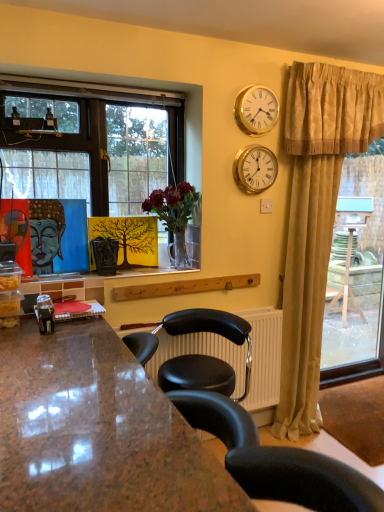
This screenshot has width=384, height=512. Describe the element at coordinates (174, 214) in the screenshot. I see `clear glass vase at center` at that location.

What is the approximate height of painted wood window sill at center?

painted wood window sill at center is 1.37 inches in height.

Locate an element on the screen. matte blue buddha at left is located at coordinates (46, 233).

What do you see at coordinates (255, 169) in the screenshot? I see `gold metallic clock at upper right, which is the 2th clock from top to bottom` at bounding box center [255, 169].

Where is `marble countertop at lower left`? The height and width of the screenshot is (512, 384). marble countertop at lower left is located at coordinates point(96,430).

The height and width of the screenshot is (512, 384). What are the coordinates of `person below the clear glass vase at center (from the image's perspective)` in the screenshot? It's located at (46, 233).

From a real-world perspective, does matte blue buddha at left stand above clear glass vase at center?

No, from a real-world perspective, matte blue buddha at left is not on top of clear glass vase at center.

Is point (30, 213) farther from viewer compared to point (176, 243)?

No.

Considering the relative sizes of matte blue buddha at left and clear glass vase at center in the image provided, is matte blue buddha at left bigger than clear glass vase at center?

Actually, matte blue buddha at left might be smaller than clear glass vase at center.

In the scene shown: From a real-world perspective, is matte blue buddha at left above or below beige fabric curtain at right?

matte blue buddha at left is situated higher than beige fabric curtain at right in the real world.

Considering the sizes of objects matte blue buddha at left and beige fabric curtain at right in the image provided, who is bigger, matte blue buddha at left or beige fabric curtain at right?

Bigger between the two is beige fabric curtain at right.

From the image's perspective, is matte blue buddha at left located above beige fabric curtain at right?

Correct, matte blue buddha at left appears higher than beige fabric curtain at right in the image.

Is matte blue buddha at left facing towards beige fabric curtain at right?

No, matte blue buddha at left is not oriented towards beige fabric curtain at right.

Does gold metallic clock at upper right, which appears as the first clock when ordered from the bottom, touch clear glass vase at center?

There is a gap between gold metallic clock at upper right, which appears as the first clock when ordered from the bottom, and clear glass vase at center.

Is gold metallic clock at upper right, which appears as the first clock when ordered from the bottom, positioned in front of clear glass vase at center?

No, gold metallic clock at upper right, which appears as the first clock when ordered from the bottom, is further to the viewer.

Considering the points (263, 172) and (165, 196), which point is behind, point (263, 172) or point (165, 196)?

The point (263, 172) is farther.

Looking at this image, from the image's perspective, between gold metallic clock at upper right, which is the 2th clock from top to bottom, and clear glass vase at center, which one is located above?

gold metallic clock at upper right, which is the 2th clock from top to bottom.

Between gold metallic clock at upper right, acting as the 1th clock starting from the top, and matte blue buddha at left, which one is positioned behind?

gold metallic clock at upper right, acting as the 1th clock starting from the top.

Consider the image. How many degrees apart are the facing directions of gold metallic clock at upper right, the 2th clock positioned from the bottom, and matte blue buddha at left?

They differ by 1.22 degrees in their facing directions.

Which of these two, gold metallic clock at upper right, the 2th clock positioned from the bottom, or matte blue buddha at left, is bigger?

matte blue buddha at left.

Is gold metallic clock at upper right, the 2th clock positioned from the bottom, at the left side of matte blue buddha at left?

No.

From their relative heights in the image, would you say marble countertop at lower left is taller or shorter than clear glass vase at center?

marble countertop at lower left is taller than clear glass vase at center.

What's the angular difference between marble countertop at lower left and clear glass vase at center's facing directions?

There is a 91.6-degree angle between the facing directions of marble countertop at lower left and clear glass vase at center.

Looking at this image, could you tell me if marble countertop at lower left is facing clear glass vase at center?

No, marble countertop at lower left is not turned towards clear glass vase at center.

From the image's perspective, is marble countertop at lower left above or below clear glass vase at center?

From the image's perspective, marble countertop at lower left appears below clear glass vase at center.

Is clear glass vase at center oriented away from marble countertop at lower left?

No, clear glass vase at center is not facing the opposite direction of marble countertop at lower left.

Considering the sizes of objects clear glass vase at center and marble countertop at lower left in the image provided, who is smaller, clear glass vase at center or marble countertop at lower left?

With smaller size is clear glass vase at center.

Between clear glass vase at center and marble countertop at lower left, which one appears on the left side from the viewer's perspective?

marble countertop at lower left.

From the picture: Is clear glass vase at center outside of beige fabric curtain at right?

Absolutely, clear glass vase at center is external to beige fabric curtain at right.

Considering the points (174, 258) and (293, 143), which point is behind, point (174, 258) or point (293, 143)?

The point (174, 258) is farther.

From the image's perspective, would you say clear glass vase at center is positioned over beige fabric curtain at right?

Yes, from the image's perspective, clear glass vase at center is above beige fabric curtain at right.

From a real-world perspective, which is physically below, clear glass vase at center or beige fabric curtain at right?

From a 3D spatial view, beige fabric curtain at right is below.

At what (x,y) coordinates should I click in order to perform the action: click on houseplant in front of the matte blue buddha at left. Please return your answer as a coordinate pair (x, y). The width and height of the screenshot is (384, 512). Looking at the image, I should click on (174, 214).

The height and width of the screenshot is (512, 384). I want to click on person that is above the beige fabric curtain at right (from a real-world perspective), so click(46, 233).

Considering their positions, is painted wood window sill at center positioned closer to gold metallic clock at upper right, acting as the 1th clock starting from the top, than marble countertop at lower left?

painted wood window sill at center.

Based on their spatial positions, is clear glass vase at center or gold metallic clock at upper right, which appears as the first clock when ordered from the bottom, further from painted wood window sill at center?

gold metallic clock at upper right, which appears as the first clock when ordered from the bottom, is further to painted wood window sill at center.

From the image, which object appears to be nearer to beige fabric curtain at right, marble countertop at lower left or matte blue buddha at left?

matte blue buddha at left is closer to beige fabric curtain at right.

Looking at the image, which one is located closer to gold metallic clock at upper right, acting as the 1th clock starting from the top, beige fabric curtain at right or marble countertop at lower left?

beige fabric curtain at right.

Estimate the real-world distances between objects in this image. Which object is closer to painted wood window sill at center, gold metallic clock at upper right, which is the 2th clock from top to bottom, or beige fabric curtain at right?

Among the two, gold metallic clock at upper right, which is the 2th clock from top to bottom, is located nearer to painted wood window sill at center.

When comparing their distances from clear glass vase at center, does gold metallic clock at upper right, acting as the 1th clock starting from the top, or marble countertop at lower left seem further?

marble countertop at lower left is positioned further to the anchor clear glass vase at center.

Which object lies further to the anchor point gold metallic clock at upper right, acting as the 1th clock starting from the top, gold metallic clock at upper right, which appears as the first clock when ordered from the bottom, or beige fabric curtain at right?

beige fabric curtain at right is positioned further to the anchor gold metallic clock at upper right, acting as the 1th clock starting from the top.

When comparing their distances from clear glass vase at center, does matte blue buddha at left or painted wood window sill at center seem closer?

painted wood window sill at center.

Locate an element on the screen. This screenshot has height=512, width=384. houseplant between gold metallic clock at upper right, the 2th clock positioned from the bottom, and painted wood window sill at center vertically is located at coordinates (174, 214).

Where is `window sill located between matte blue buddha at left and clear glass vase at center in the left-right direction`? The height and width of the screenshot is (512, 384). window sill located between matte blue buddha at left and clear glass vase at center in the left-right direction is located at coordinates (105, 277).

Where is `clock situated between matte blue buddha at left and gold metallic clock at upper right, which is the 2th clock from top to bottom, from left to right`? Image resolution: width=384 pixels, height=512 pixels. clock situated between matte blue buddha at left and gold metallic clock at upper right, which is the 2th clock from top to bottom, from left to right is located at coordinates (256, 109).

This screenshot has height=512, width=384. Find the location of `window sill between marble countertop at lower left and gold metallic clock at upper right, which appears as the first clock when ordered from the bottom, from front to back`. window sill between marble countertop at lower left and gold metallic clock at upper right, which appears as the first clock when ordered from the bottom, from front to back is located at coordinates (105, 277).